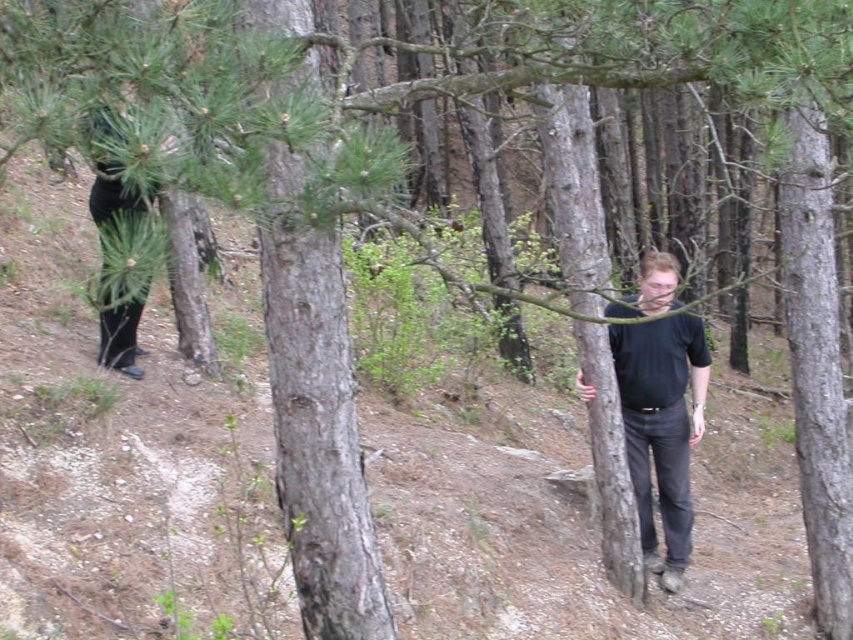
Does black matte shirt at center appear over black matte pants at left?

No, black matte shirt at center is not above black matte pants at left.

Based on the photo, who is higher up, black matte shirt at center or black matte pants at left?

Positioned higher is black matte pants at left.

Is point (670, 593) less distant than point (135, 212)?

No.

The height and width of the screenshot is (640, 853). In order to click on black matte shirt at center in this screenshot , I will do `click(660, 428)`.